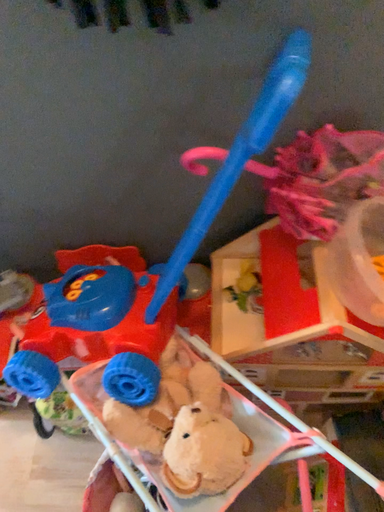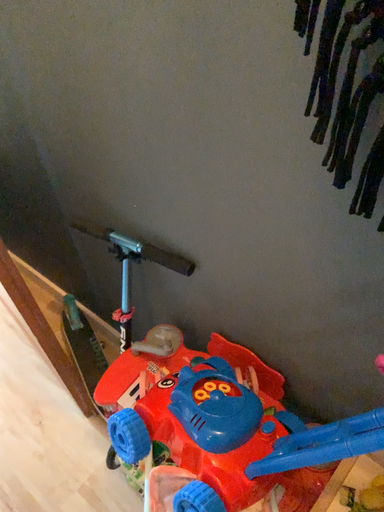
Question: How did the camera likely rotate when shooting the video?

Choices:
 (A) rotated downward
 (B) rotated upward

Answer: (B)